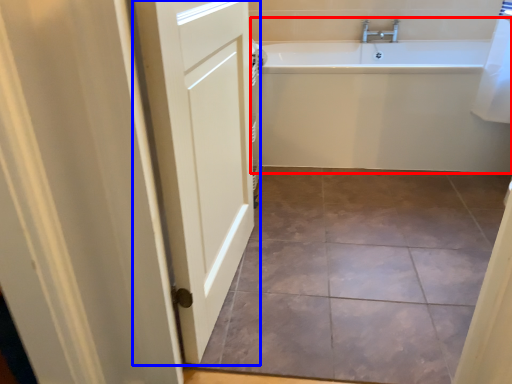
Question: Which point is further to the camera, bathtub (highlighted by a red box) or door (highlighted by a blue box)?

Choices:
 (A) bathtub
 (B) door

Answer: (A)